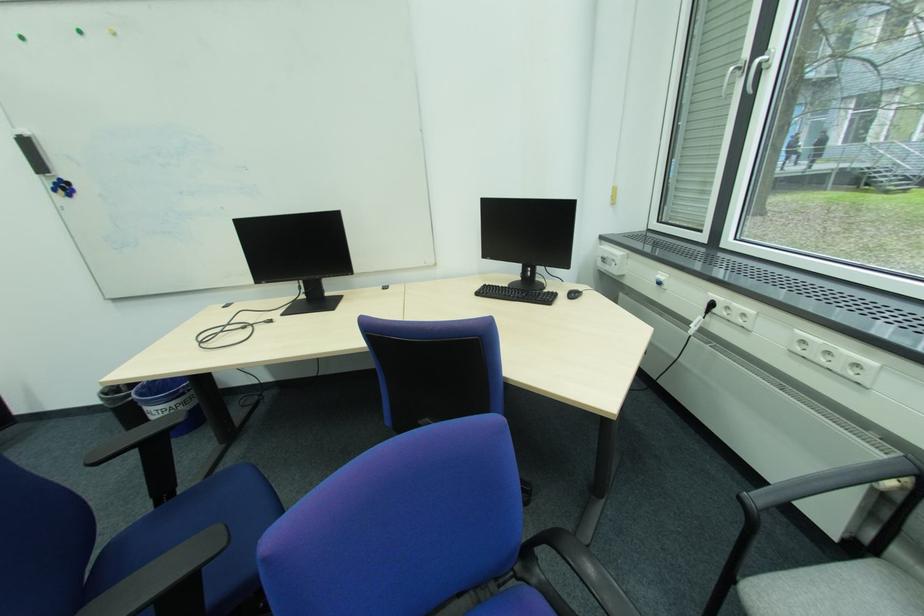
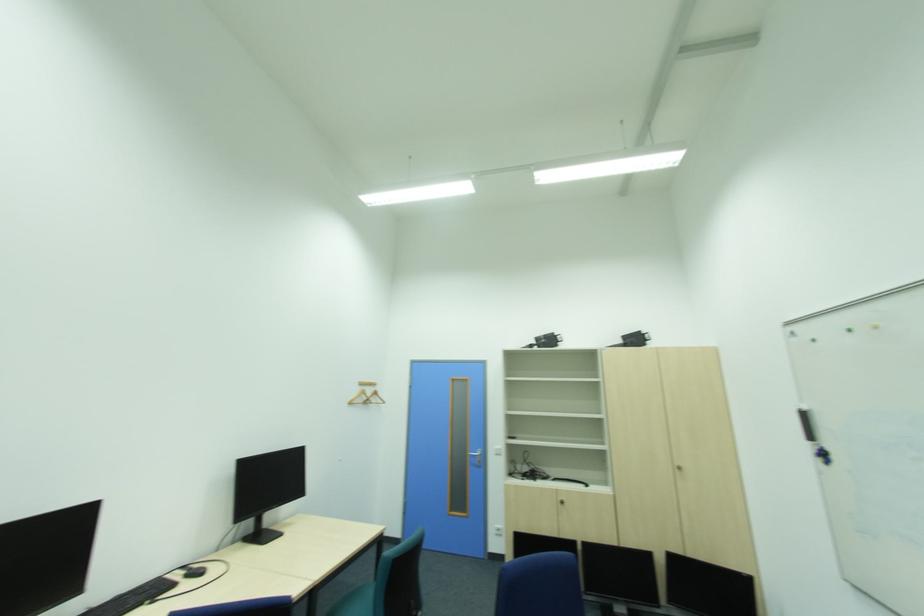
Question: The images are taken continuously from a first-person perspective. In which direction is your viewpoint rotating?

Choices:
 (A) Left
 (B) Right
 (C) Up
 (D) Down

Answer: (A)